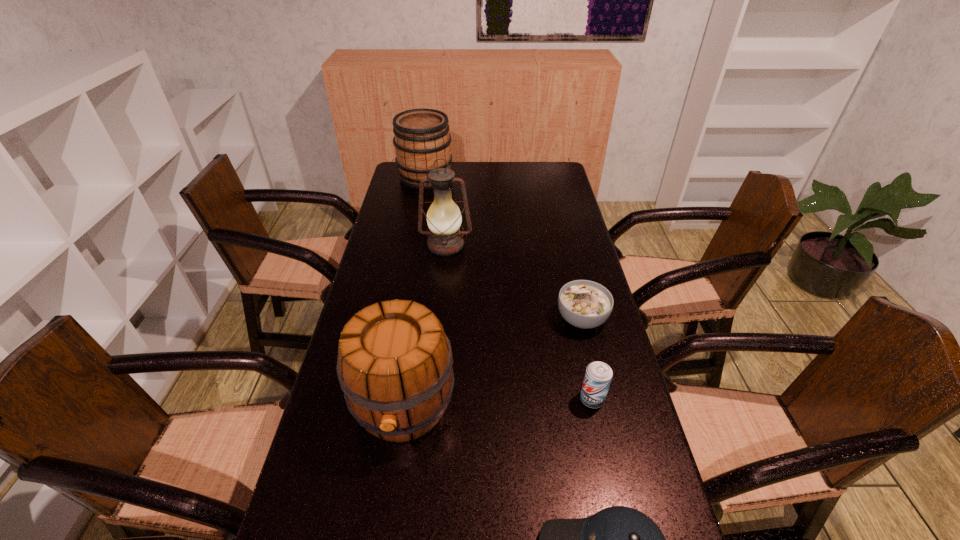
At what (x,y) coordinates should I click in order to perform the action: click on oil lamp. Please return your answer as a coordinate pair (x, y). This screenshot has height=540, width=960. Looking at the image, I should click on (444, 218).

Where is `the second farthest object`? The height and width of the screenshot is (540, 960). the second farthest object is located at coordinates (444, 218).

This screenshot has width=960, height=540. Identify the location of the farthest object. point(422,136).

The height and width of the screenshot is (540, 960). What are the coordinates of `the nearer cider` in the screenshot? It's located at click(x=395, y=368).

The image size is (960, 540). Identify the location of the fourth tallest object. (598, 375).

The height and width of the screenshot is (540, 960). Find the location of `the third farthest object`. the third farthest object is located at coordinates (585, 304).

Image resolution: width=960 pixels, height=540 pixels. Identify the location of free point located on the right of the tallest object. (563, 245).

Identify the location of free space located 0.220m on the right of the farthest object. (503, 178).

This screenshot has width=960, height=540. Identify the location of vacant space positioned 0.110m on the side of the nearer cider where the spigot is located. (388, 510).

Where is `vacant space located 0.070m on the right of the fourth tallest object`? vacant space located 0.070m on the right of the fourth tallest object is located at coordinates click(633, 399).